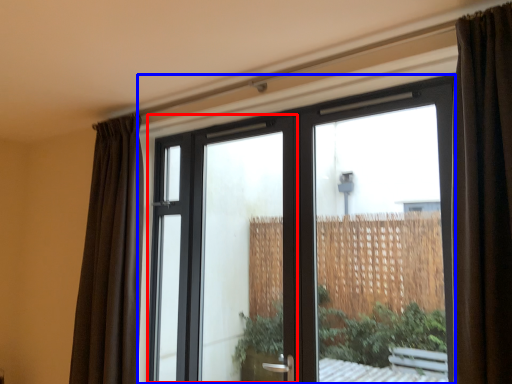
Question: Which object is closer to the camera taking this photo, screen door (highlighted by a red box) or window (highlighted by a blue box)?

Choices:
 (A) screen door
 (B) window

Answer: (B)